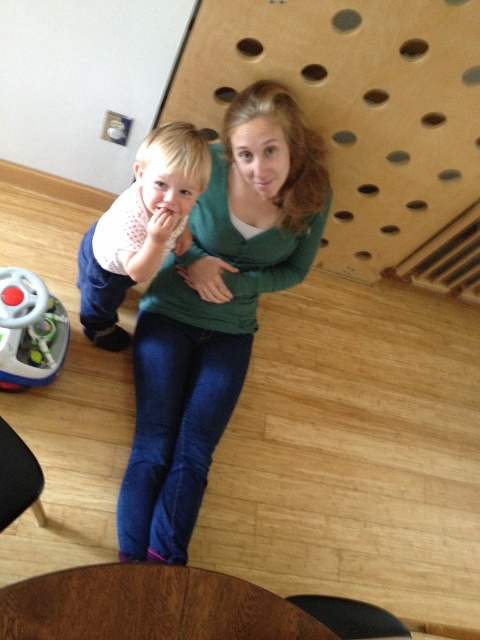
Question: Among these objects, which one is farthest from the camera?

Choices:
 (A) brown wood round table at lower center
 (B) matte white shirt at center

Answer: (B)

Question: Can you confirm if green matte sweater at center is wider than brown wood round table at lower center?

Choices:
 (A) yes
 (B) no

Answer: (B)

Question: Does matte white shirt at center appear on the right side of plastic steering wheel at lower left?

Choices:
 (A) no
 (B) yes

Answer: (B)

Question: Which point is closer to the camera?

Choices:
 (A) green matte sweater at center
 (B) matte white shirt at center
 (C) brown wood round table at lower center

Answer: (C)

Question: Can you confirm if matte white shirt at center is smaller than plastic steering wheel at lower left?

Choices:
 (A) yes
 (B) no

Answer: (B)

Question: Which of the following is the closest to the observer?

Choices:
 (A) green matte sweater at center
 (B) plastic steering wheel at lower left
 (C) brown wood round table at lower center

Answer: (C)